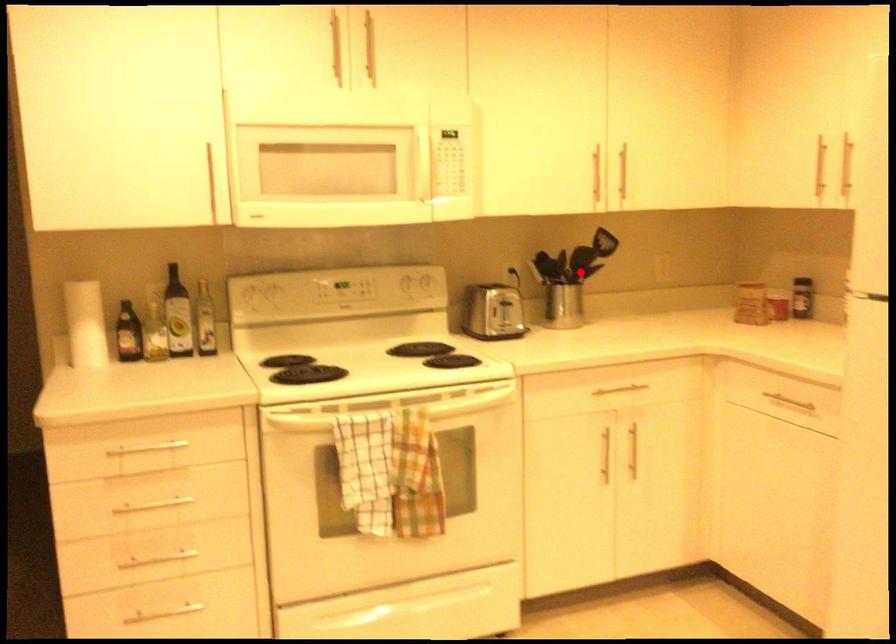
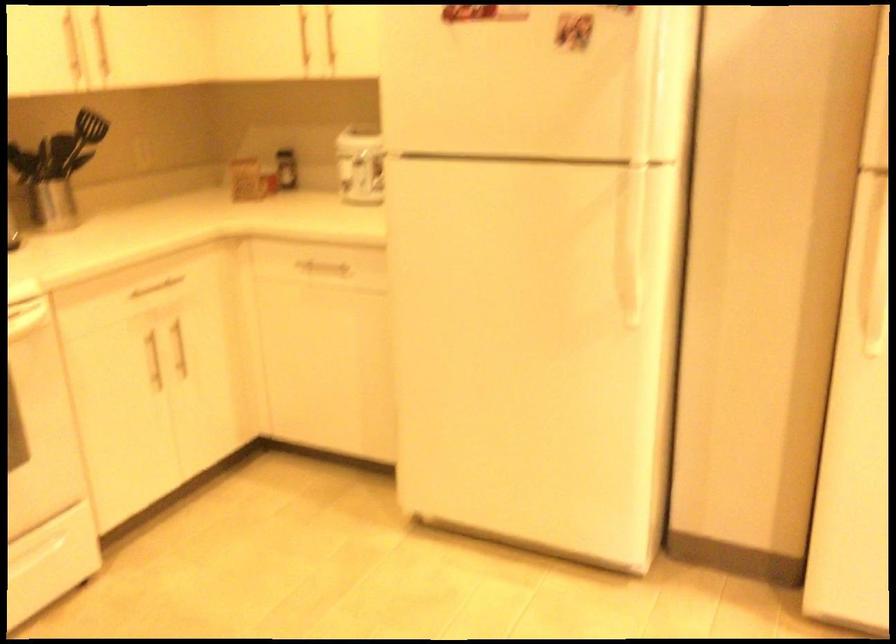
Locate, in the second image, the point that corresponds to the highlighted location in the first image.

(56, 169)